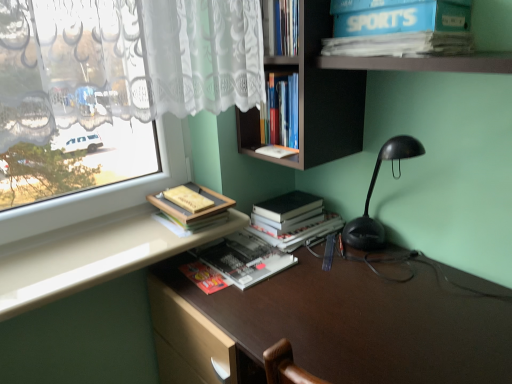
Where is `free location above brown matte desk at center (from a real-world perspective)`? free location above brown matte desk at center (from a real-world perspective) is located at coordinates (339, 291).